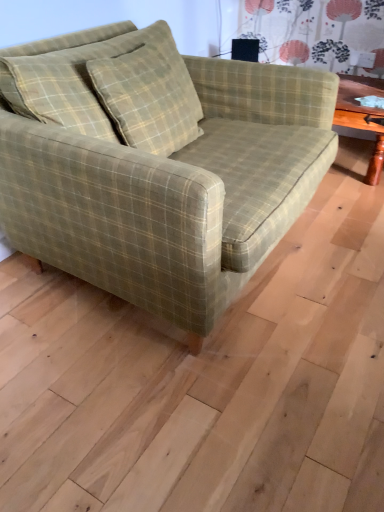
Question: From the image's perspective, is green plaid fabric couch at center located above or below green plaid pillow at center?

Choices:
 (A) above
 (B) below

Answer: (B)

Question: Relative to green plaid pillow at center, is green plaid fabric couch at center in front or behind?

Choices:
 (A) front
 (B) behind

Answer: (A)

Question: Is green plaid fabric couch at center bigger or smaller than green plaid pillow at center?

Choices:
 (A) small
 (B) big

Answer: (B)

Question: Is point (36, 96) positioned closer to the camera than point (221, 81)?

Choices:
 (A) closer
 (B) farther

Answer: (A)

Question: Looking at the image, does green plaid pillow at center seem bigger or smaller compared to green plaid fabric couch at center?

Choices:
 (A) small
 (B) big

Answer: (A)

Question: Considering the relative positions of green plaid pillow at center and green plaid fabric couch at center in the image provided, is green plaid pillow at center to the left or to the right of green plaid fabric couch at center?

Choices:
 (A) left
 (B) right

Answer: (A)

Question: From the image's perspective, is green plaid pillow at center positioned above or below green plaid fabric couch at center?

Choices:
 (A) above
 (B) below

Answer: (A)